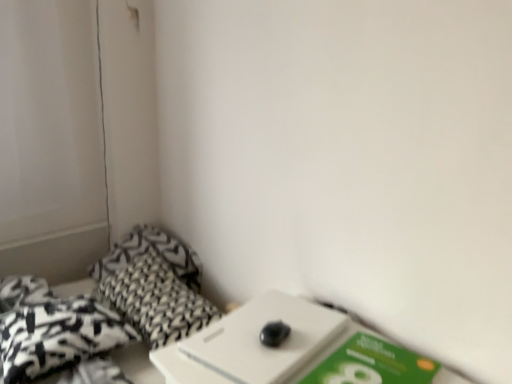
I want to click on free space above white plastic table at lower left (from a real-world perspective), so pos(261,332).